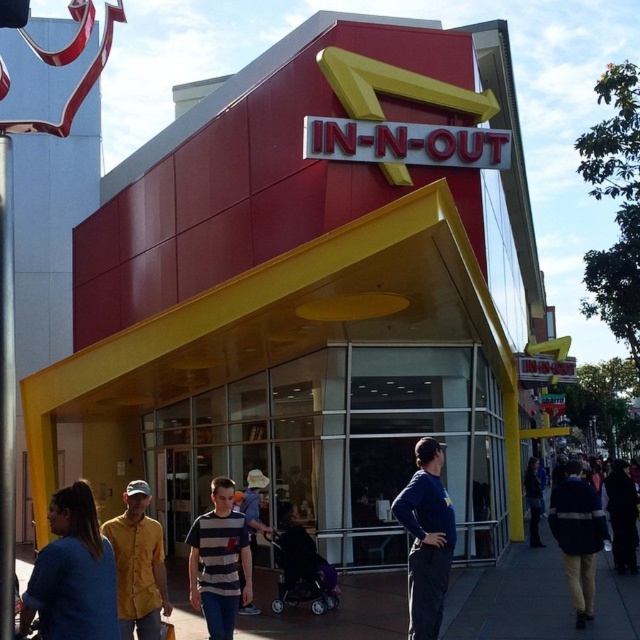
Between dark gray concrete sidewalk at lower center and dark blue jacket at lower right, which one is positioned lower?

Positioned lower is dark blue jacket at lower right.

Is dark gray concrete sidewalk at lower center thinner than dark blue jacket at lower right?

Correct, dark gray concrete sidewalk at lower center's width is less than dark blue jacket at lower right's.

Where is `dark gray concrete sidewalk at lower center`? This screenshot has height=640, width=640. dark gray concrete sidewalk at lower center is located at coordinates (538, 600).

Which is behind, point (88, 596) or point (529, 465)?

The point (529, 465) is more distant.

Who is positioned more to the left, blue cotton shirt at lower left or dark blue jacket at lower right?

blue cotton shirt at lower left is more to the left.

Is point (52, 560) farther from camera compared to point (529, 522)?

No, (52, 560) is closer to viewer.

Image resolution: width=640 pixels, height=640 pixels. What are the coordinates of `blue cotton shirt at lower left` in the screenshot? It's located at (72, 573).

Who is more distant from viewer, (529, 592) or (241, 609)?

Point (529, 592)

Which is in front, point (556, 589) or point (241, 596)?

Point (241, 596)

Locate an element on the screen. dark gray concrete sidewalk at lower center is located at coordinates (538, 600).